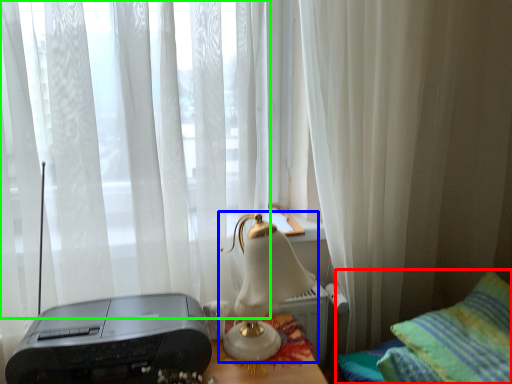
Question: Estimate the real-world distances between objects in this image. Which object is closer to furniture (highlighted by a red box), lamp (highlighted by a blue box) or curtain (highlighted by a green box)?

Choices:
 (A) lamp
 (B) curtain

Answer: (A)